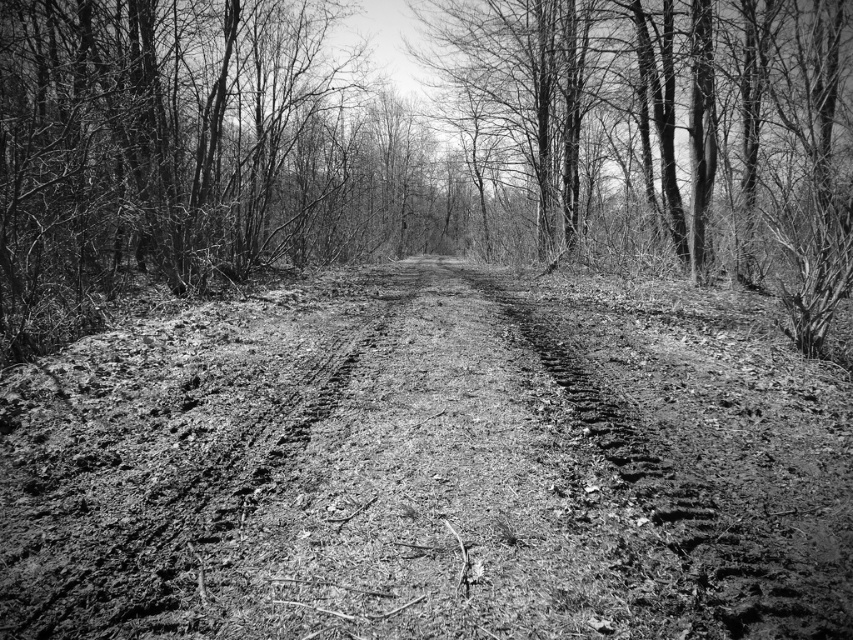
Is point (442, 481) more distant than point (711, 145)?

No, it is not.

Between point (422, 460) and point (70, 3), which one is positioned in front?

Point (422, 460)

The image size is (853, 640). Describe the element at coordinates (426, 470) in the screenshot. I see `dirt track at center` at that location.

Where is `dirt track at center`? dirt track at center is located at coordinates (426, 470).